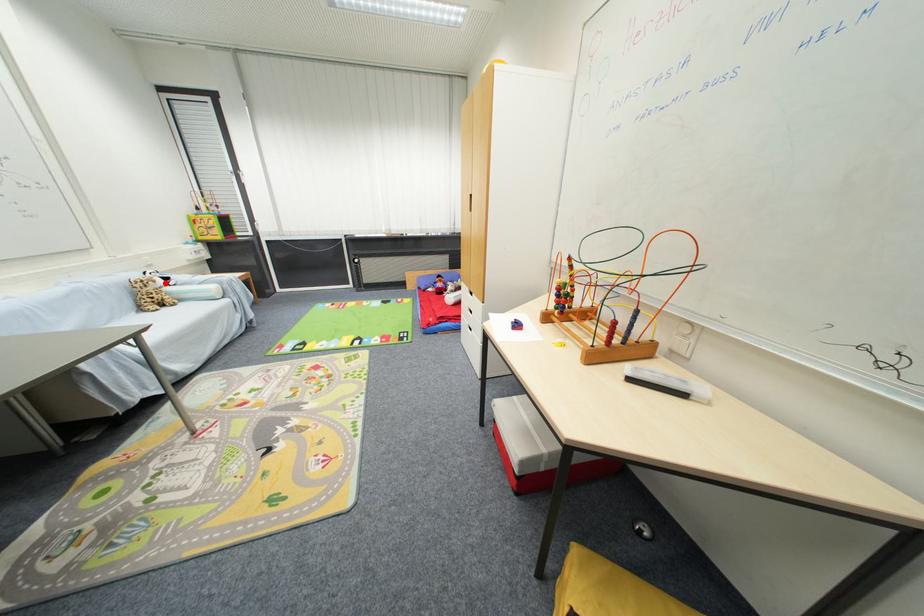
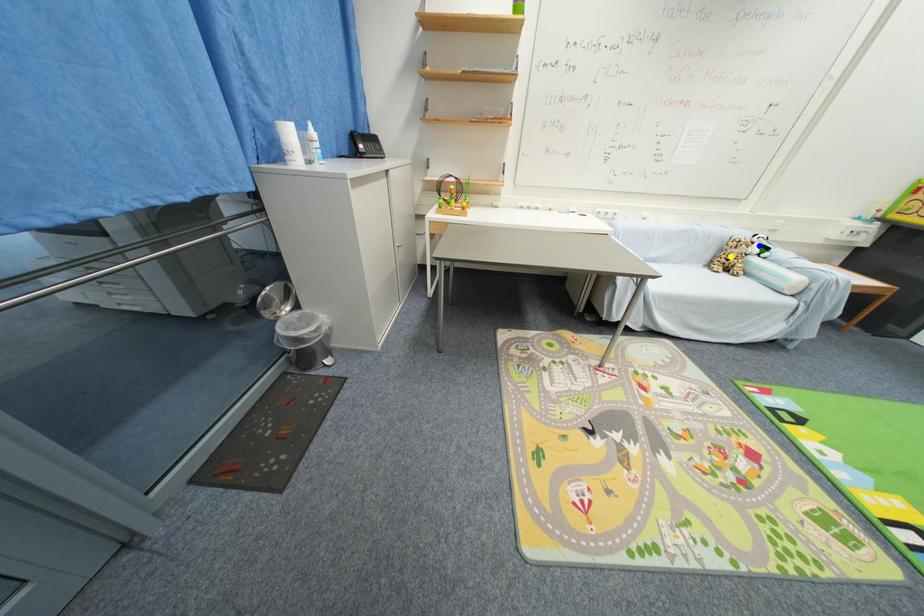
Question: I am providing you with two images of the same scene from different viewpoints. A red point is marked on the first image. You are given multiple points on the second image. Can you choose the point in image 2 that corresponds to the point in image 1?

Choices:
 (A) yellow point
 (B) blue point
 (C) green point

Answer: (C)